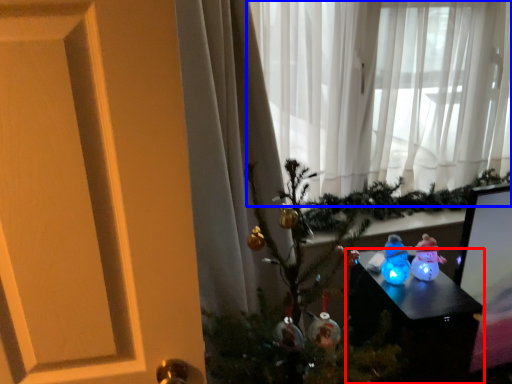
Question: Which object is closer to the camera taking this photo, furniture (highlighted by a red box) or curtain (highlighted by a blue box)?

Choices:
 (A) furniture
 (B) curtain

Answer: (A)